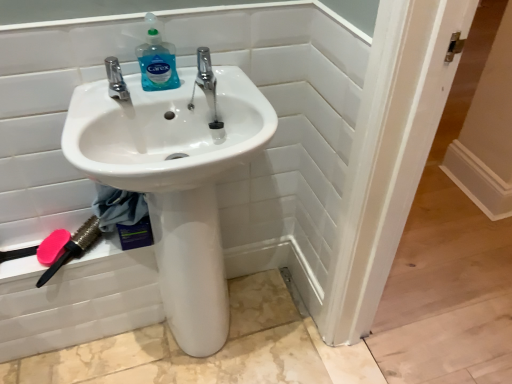
Identify the location of vacant space situated on the left part of polished chrome tap at center, the 1th tap positioned from the right. The height and width of the screenshot is (384, 512). (142, 89).